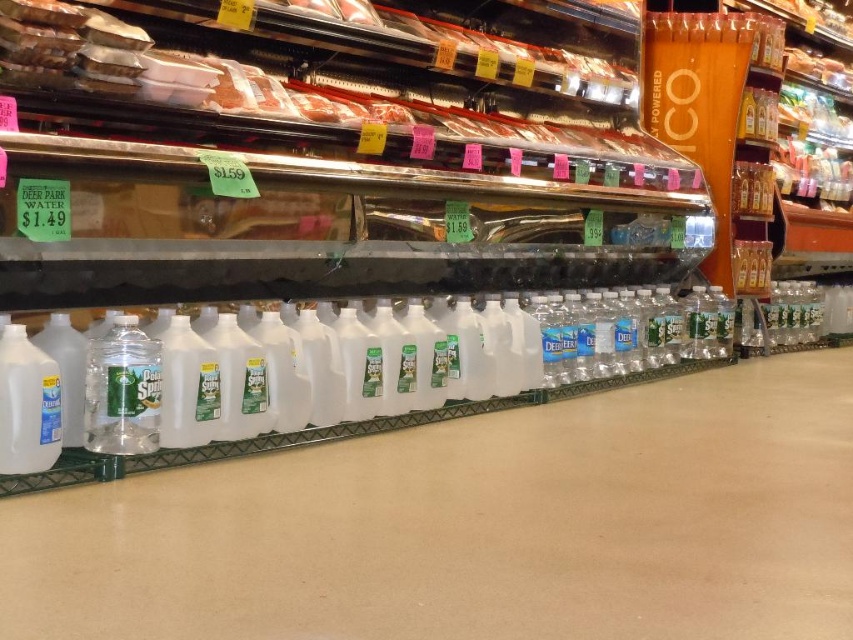
Consider the image. You are a store employee who needs to place a new price tag for the clear plastic bottle at lower left. According to the store layout coordinates, where exactly should you place the price tag?

The clear plastic bottle at lower left is located at point (122, 390), so the price tag should be placed at those coordinates.

You are a customer in the grocery store and want to compare the sizes of the clear plastic bottle at lower left and the white plastic milk jug at lower left. Which one takes up more space on the shelf?

The clear plastic bottle at lower left is larger in size than the white plastic milk jug at lower left, so it takes up more space on the shelf.